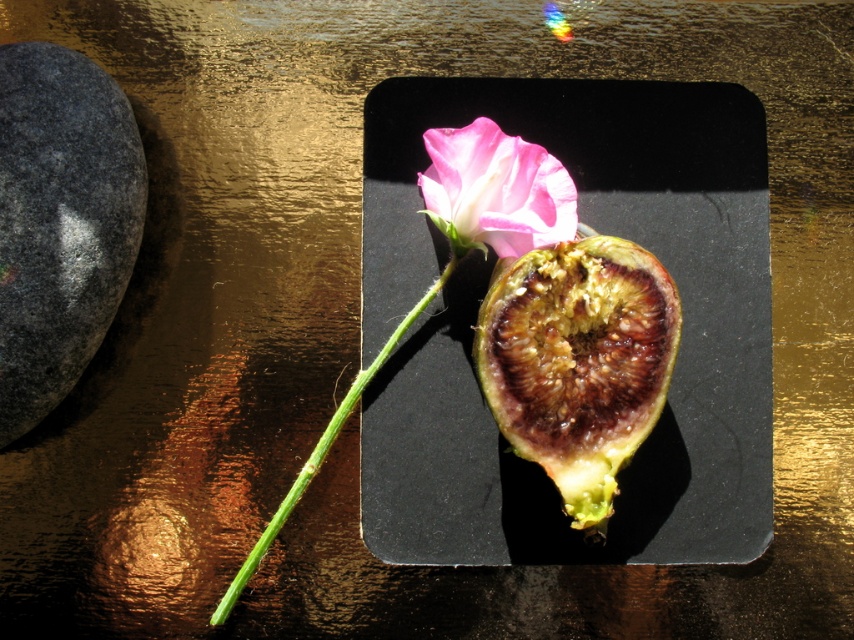
You are an artist setting up a still life. You have a gray granite rock at left and a brown fibrous fig at center. You want to place a small vase between them. Is there enough space for the vase if it requires 15 inches of space?

The gray granite rock at left is 18.35 inches from the brown fibrous fig at center, so yes, there is enough space for the vase since 18.35 inches is greater than the required 15 inches.

You are an artist setting up a still life. You have a brown fibrous fig at center and a pink matte flower at center. Which object is positioned to the right of the other?

The brown fibrous fig at center is to the right of the pink matte flower at center.